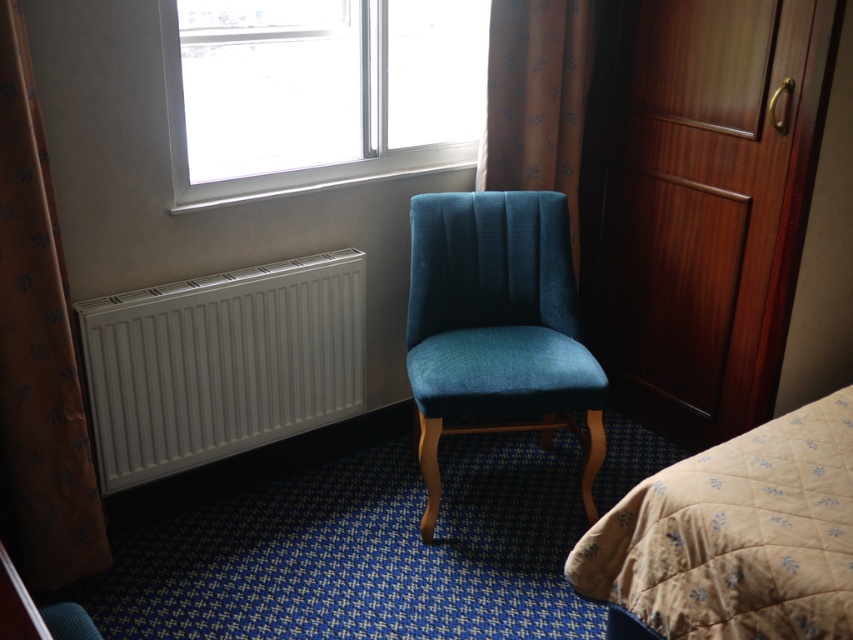
Is white matte radiator at lower left taller than teal fabric chair at center?

No.

Does white matte radiator at lower left appear over teal fabric chair at center?

Actually, white matte radiator at lower left is below teal fabric chair at center.

The height and width of the screenshot is (640, 853). Describe the element at coordinates (221, 364) in the screenshot. I see `white matte radiator at lower left` at that location.

Locate an element on the screen. The height and width of the screenshot is (640, 853). white matte radiator at lower left is located at coordinates (221, 364).

Is point (415, 344) positioned before point (524, 115)?

Yes, it is in front of point (524, 115).

Is teal fabric chair at center to the right of velvet dark blue curtain at upper center from the viewer's perspective?

No, teal fabric chair at center is not to the right of velvet dark blue curtain at upper center.

The image size is (853, 640). What are the coordinates of `teal fabric chair at center` in the screenshot? It's located at (496, 323).

Which is behind, point (635, 563) or point (3, 292)?

Positioned behind is point (3, 292).

Is point (827, 404) positioned after point (30, 522)?

That is False.

Identify the location of beige quilted bed at lower right. The height and width of the screenshot is (640, 853). (735, 536).

Find the location of a particular element. beige quilted bed at lower right is located at coordinates (735, 536).